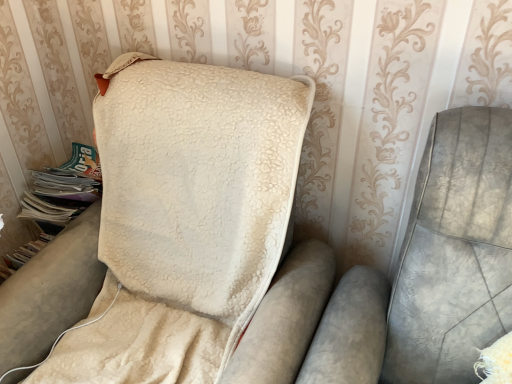
Question: Can you confirm if green paper magazine at left is positioned to the right of beige fleece blanket at center?

Choices:
 (A) no
 (B) yes

Answer: (A)

Question: Is green paper magazine at left to the left of beige fleece blanket at center from the viewer's perspective?

Choices:
 (A) no
 (B) yes

Answer: (B)

Question: From the image's perspective, is green paper magazine at left beneath beige fleece blanket at center?

Choices:
 (A) no
 (B) yes

Answer: (A)

Question: Can we say green paper magazine at left lies outside beige fleece blanket at center?

Choices:
 (A) no
 (B) yes

Answer: (B)

Question: From the image's perspective, is green paper magazine at left located above beige fleece blanket at center?

Choices:
 (A) no
 (B) yes

Answer: (B)

Question: Can you confirm if green paper magazine at left is bigger than beige fleece blanket at center?

Choices:
 (A) yes
 (B) no

Answer: (B)

Question: From a real-world perspective, is beige fleece blanket at center on top of green paper magazine at left?

Choices:
 (A) no
 (B) yes

Answer: (A)

Question: Does beige fleece blanket at center contain green paper magazine at left?

Choices:
 (A) yes
 (B) no

Answer: (B)

Question: Would you say beige fleece blanket at center is outside green paper magazine at left?

Choices:
 (A) yes
 (B) no

Answer: (A)

Question: Is beige fleece blanket at center placed right next to green paper magazine at left?

Choices:
 (A) yes
 (B) no

Answer: (B)

Question: From the image's perspective, is beige fleece blanket at center above green paper magazine at left?

Choices:
 (A) no
 (B) yes

Answer: (A)

Question: Is beige fleece blanket at center at the right side of green paper magazine at left?

Choices:
 (A) no
 (B) yes

Answer: (B)

Question: In the image, is green paper magazine at left on the left side or the right side of beige fleece blanket at center?

Choices:
 (A) right
 (B) left

Answer: (B)